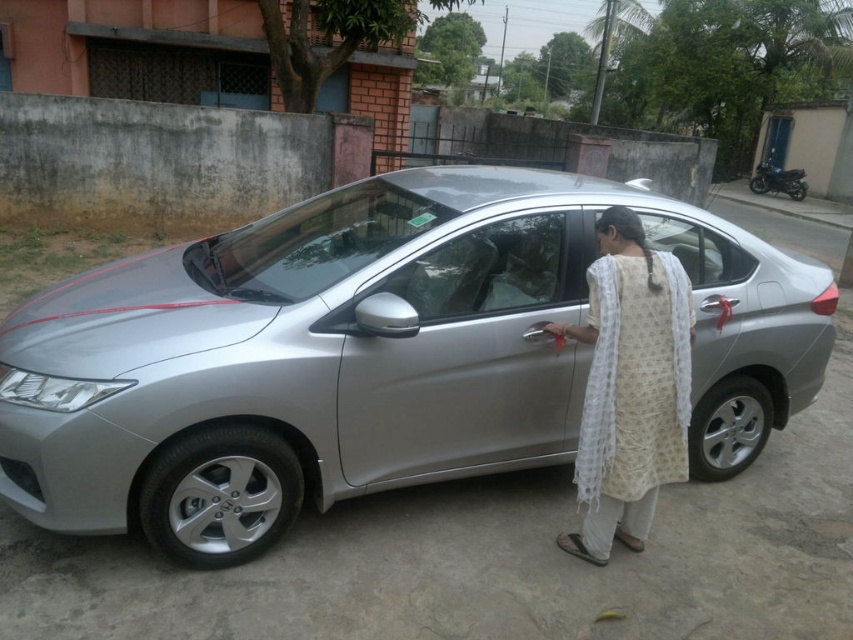
You are a delivery person who needs to park your van next to the satin silver car at center and the white printed robe at center. Since the van is 2 meters wide, will there be enough space between the two objects to park?

The satin silver car at center is wider than the white printed robe at center. However, since the van is 2 meters wide, there might not be enough space between them unless the distance between the car and the robe exceeds 2 meters. The description only states the car is wider, not the distance between them.

You are a delivery person who needs to load a package onto the roof of the satin silver car at center. The package is 1 meter tall. Can you safely place it there without damaging the white printed robe at center?

The satin silver car at center is taller than the white printed robe at center. Since the car is taller, the package can be placed on the roof without affecting the robe, as the robe is shorter and likely positioned beside the car, not on the roof.

You are a delivery person trying to park your van in the parking lot where the satin silver car at center and the white printed robe at center are located. According to the parking rules, you must park your vehicle so that it does not overlap with any existing objects. Based on the scene, can you safely park your van here?

The satin silver car at center is positioned over the white printed robe at center, meaning there is no space between them for the van to park without overlapping. Therefore, it is not safe to park the van here.